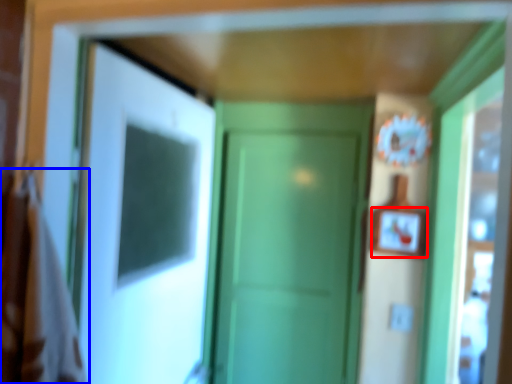
Question: Which object is closer to the camera taking this photo, picture frame (highlighted by a red box) or laundry (highlighted by a blue box)?

Choices:
 (A) picture frame
 (B) laundry

Answer: (B)